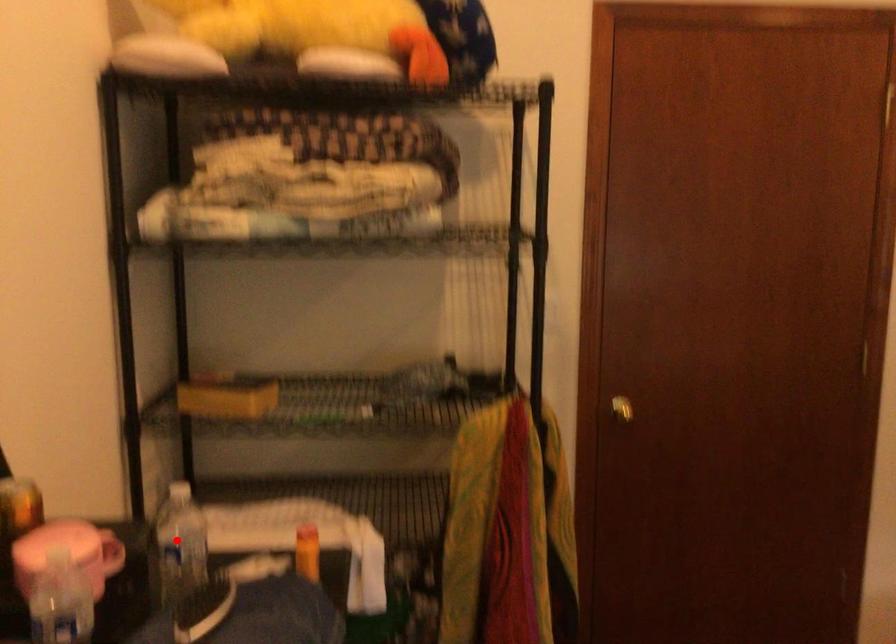
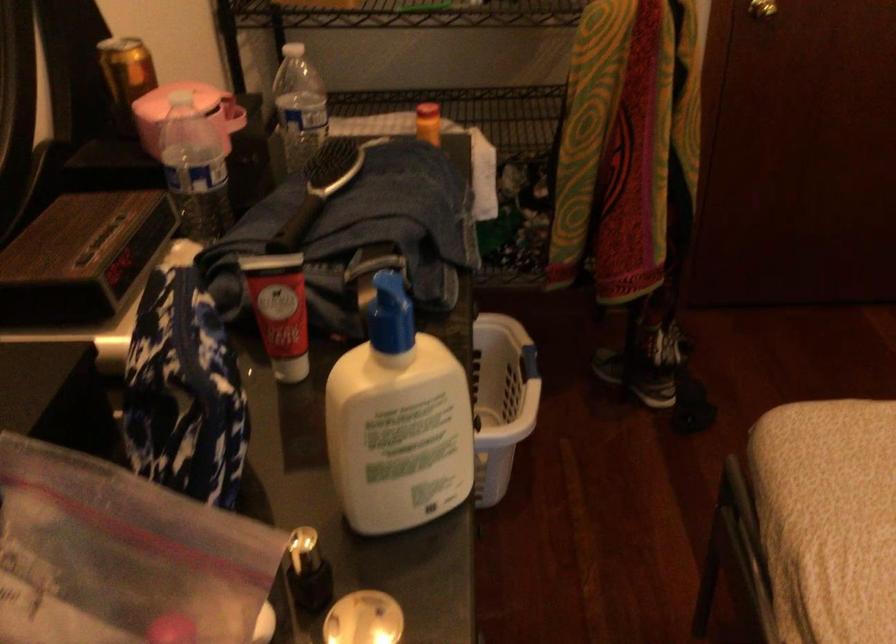
Question: I am providing you with two images of the same scene from different viewpoints. Given a red point in image1, look at the same physical point in image2. Is it:

Choices:
 (A) Closer to the viewpoint
 (B) Farther from the viewpoint

Answer: (A)